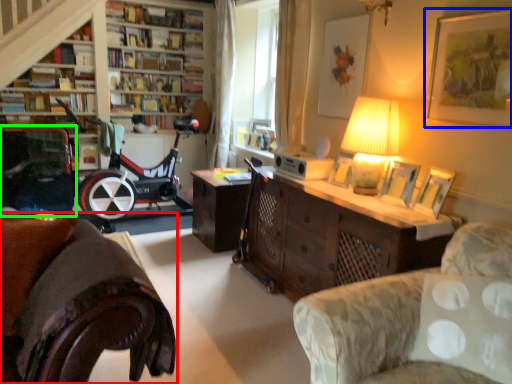
Question: Estimate the real-world distances between objects in this image. Which object is farther from studio couch (highlighted by a red box), picture frame (highlighted by a blue box) or armchair (highlighted by a green box)?

Choices:
 (A) picture frame
 (B) armchair

Answer: (B)